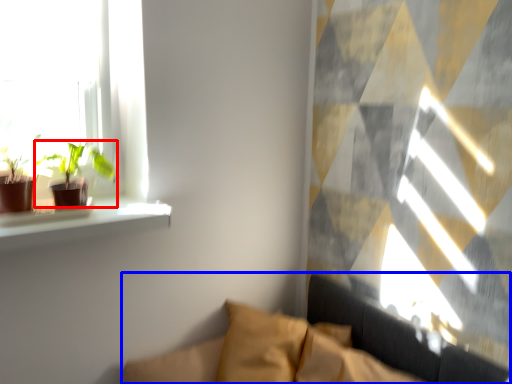
Question: Which of the following is the farthest to the observer, houseplant (highlighted by a red box) or couch (highlighted by a blue box)?

Choices:
 (A) houseplant
 (B) couch

Answer: (A)